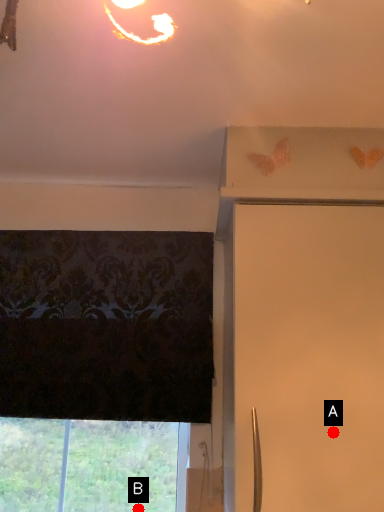
Question: Two points are circled on the image, labeled by A and B beside each circle. Which point is farther from the camera taking this photo?

Choices:
 (A) A is further
 (B) B is further

Answer: (B)